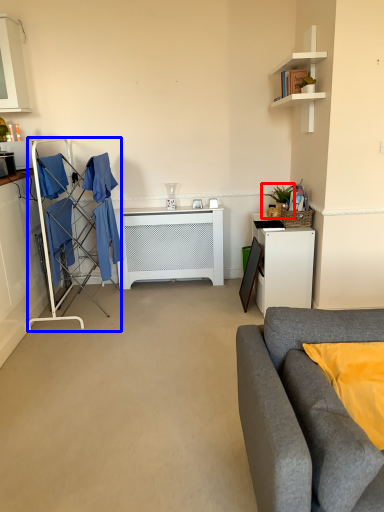
Question: Among these objects, which one is nearest to the camera, houseplant (highlighted by a red box) or closet (highlighted by a blue box)?

Choices:
 (A) houseplant
 (B) closet

Answer: (B)